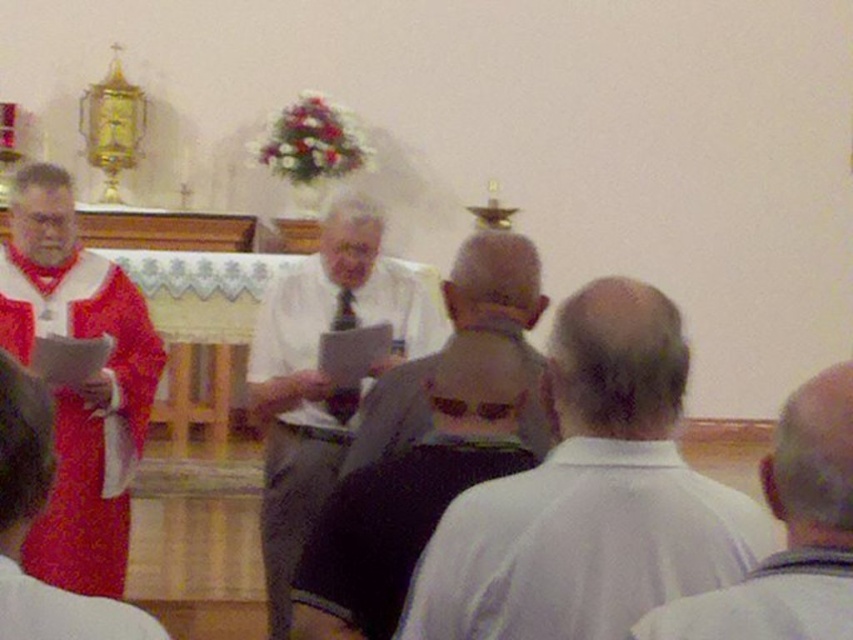
Is gray fabric shirt at center closer to camera compared to matte red robe at left?

Yes, it is in front of matte red robe at left.

Can you confirm if gray fabric shirt at center is thinner than matte red robe at left?

Incorrect, gray fabric shirt at center's width is not less than matte red robe at left's.

Measure the distance between gray fabric shirt at center and camera.

1.49 meters

Where is `gray fabric shirt at center`? Image resolution: width=853 pixels, height=640 pixels. gray fabric shirt at center is located at coordinates (590, 497).

Which is in front, point (158, 365) or point (517, 294)?

Point (517, 294) is in front.

Who is lower down, matte red robe at left or black textured shirt at center?

Positioned lower is matte red robe at left.

Who is more distant from viewer, (x=64, y=458) or (x=488, y=266)?

The point (x=64, y=458) is behind.

At what (x,y) coordinates should I click in order to perform the action: click on matte red robe at left. Please return your answer as a coordinate pair (x, y). The width and height of the screenshot is (853, 640). Looking at the image, I should click on (85, 412).

Is point (825, 458) farther from camera compared to point (850, 570)?

Yes, point (825, 458) is farther from viewer.

Is white matte shirt at center above white matte robe at lower right?

Indeed, white matte shirt at center is positioned over white matte robe at lower right.

Is point (764, 570) positioned in front of point (817, 604)?

No, it is not.

Locate an element on the screen. Image resolution: width=853 pixels, height=640 pixels. white matte shirt at center is located at coordinates (788, 532).